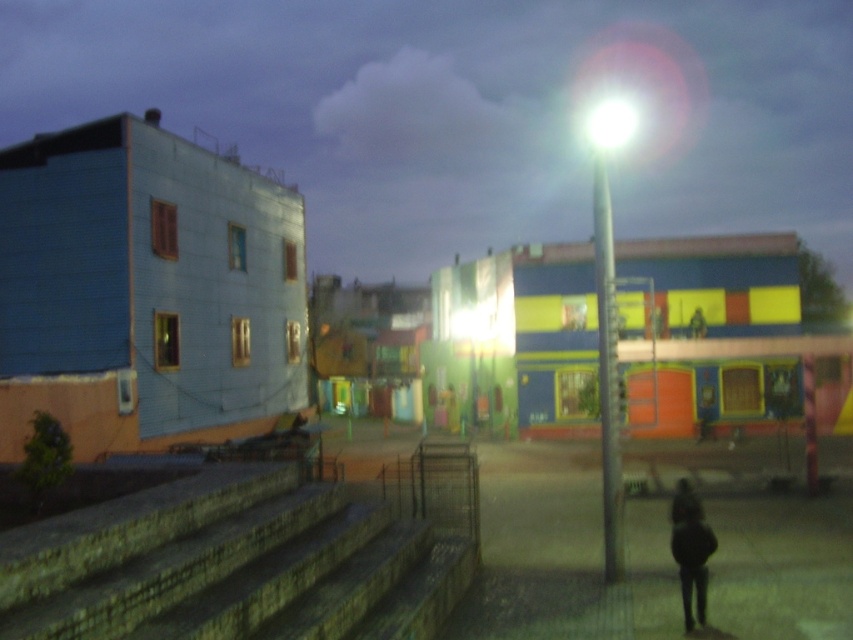
Question: Considering the real-world distances, which object is closest to the matte concrete steps at lower left?

Choices:
 (A) stone steps at lower left
 (B) dark matte clothing at lower right

Answer: (B)

Question: Does matte concrete steps at lower left have a greater width compared to silver metallic pole at center?

Choices:
 (A) yes
 (B) no

Answer: (A)

Question: Which of the following is the closest to the observer?

Choices:
 (A) dark matte clothing at lower right
 (B) silver metallic pole at center
 (C) stone steps at lower left
 (D) matte concrete steps at lower left

Answer: (C)

Question: Considering the real-world distances, which object is closest to the silver metallic pole at center?

Choices:
 (A) matte concrete steps at lower left
 (B) stone steps at lower left
 (C) dark matte clothing at lower right

Answer: (C)

Question: Can you confirm if stone steps at lower left is wider than silver metallic pole at center?

Choices:
 (A) yes
 (B) no

Answer: (B)

Question: Is silver metallic pole at center closer to the viewer compared to dark matte clothing at lower right?

Choices:
 (A) yes
 (B) no

Answer: (B)